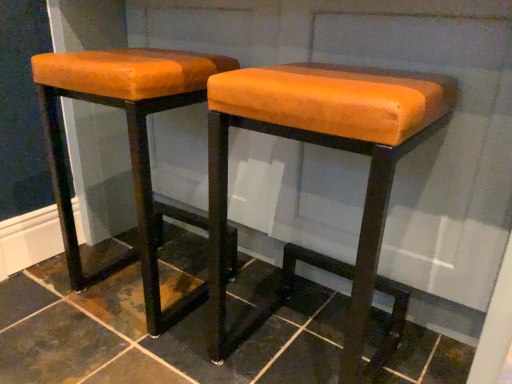
The width and height of the screenshot is (512, 384). Find the location of `vacant area on top of orange leather stool at left, placed as the second stool when sorted from right to left (from a real-world perspective)`. vacant area on top of orange leather stool at left, placed as the second stool when sorted from right to left (from a real-world perspective) is located at coordinates (136, 58).